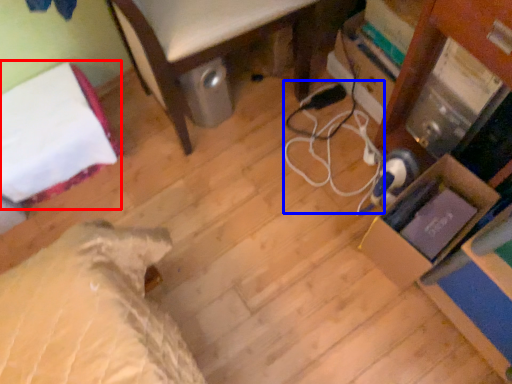
Question: Which point is further to the camera, bed (highlighted by a red box) or cable (highlighted by a blue box)?

Choices:
 (A) bed
 (B) cable

Answer: (B)